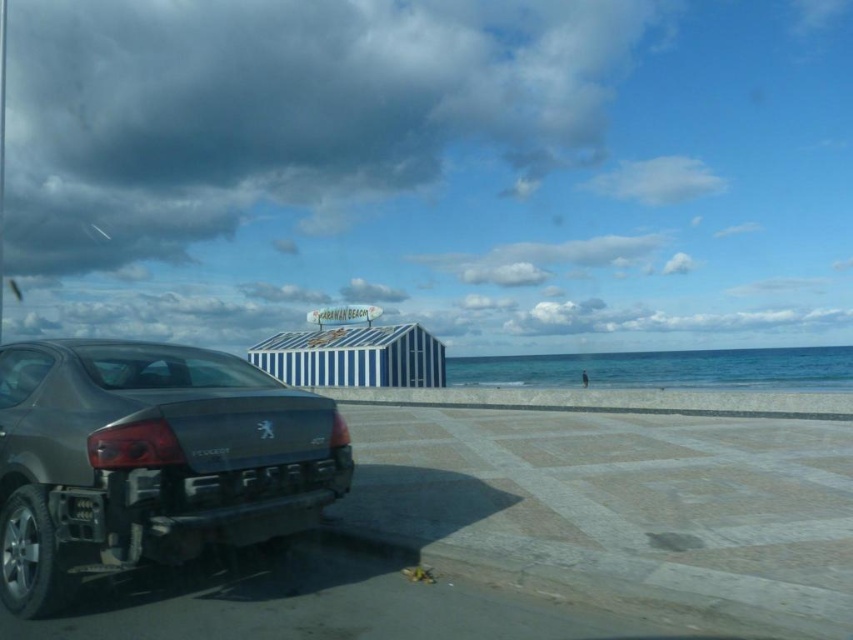
You are sitting in the driver seat of the Peugeot 407 and looking through the rear window. You want to see the white sand beach at lower right. Where should you look on the window?

You should look at the position at point (618,497) on the window to see the white sand beach at lower right.

You are sitting in the driver seat of the matte gray car at lower left and want to walk to the white sand beach at lower right. Which direction should you exit the car to face the beach?

Since the white sand beach at lower right is located below the matte gray car at lower left, you should exit the car and walk forward to face the beach.

You are sitting in the driver seat of the Peugeot 407 parked at CARAVAN BEACH. You see two points marked on the car window. The first point is at coordinate point (18, 401) and the second point is at coordinate point (73, 512). Which point is closer to you?

Point (18, 401) is behind point (73, 512), so the point closer to you is point (73, 512).